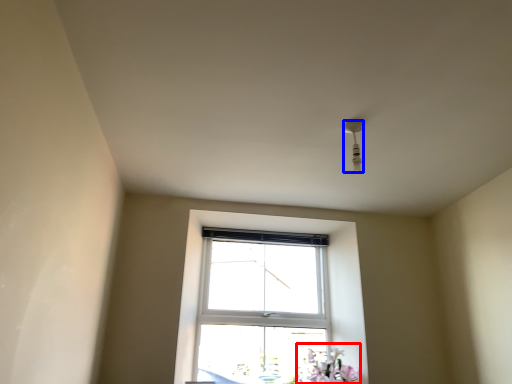
Question: Which point is closer to the camera, flower (highlighted by a red box) or light fixture (highlighted by a blue box)?

Choices:
 (A) flower
 (B) light fixture

Answer: (B)